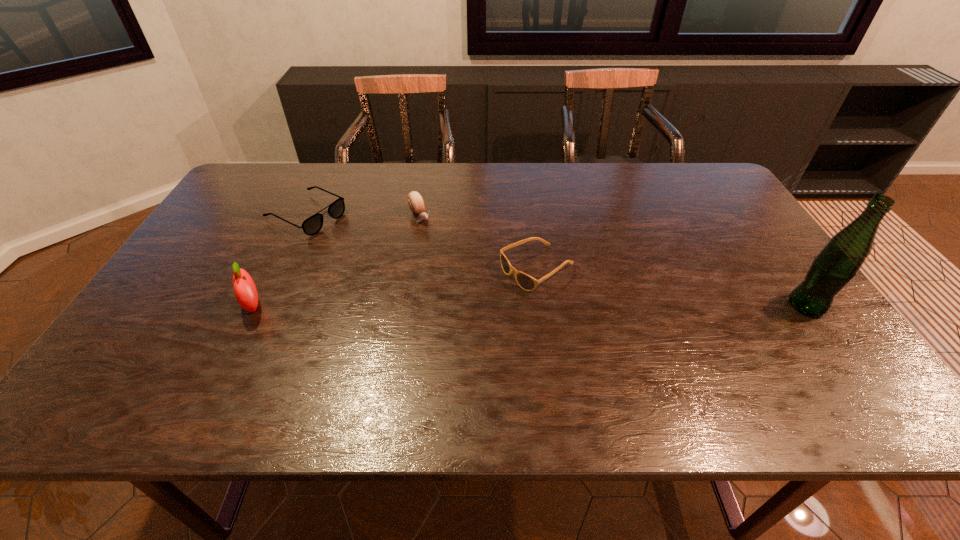
Identify the location of blank area in the image that satisfies the following two spatial constraints: 1. on the back side of the escargot; 2. on the right side of the apple. Image resolution: width=960 pixels, height=540 pixels. (297, 218).

The image size is (960, 540). What are the coordinates of `vacant region that satisfies the following two spatial constraints: 1. on the front side of the sunglasses; 2. on the left side of the rightmost object` in the screenshot? It's located at (542, 306).